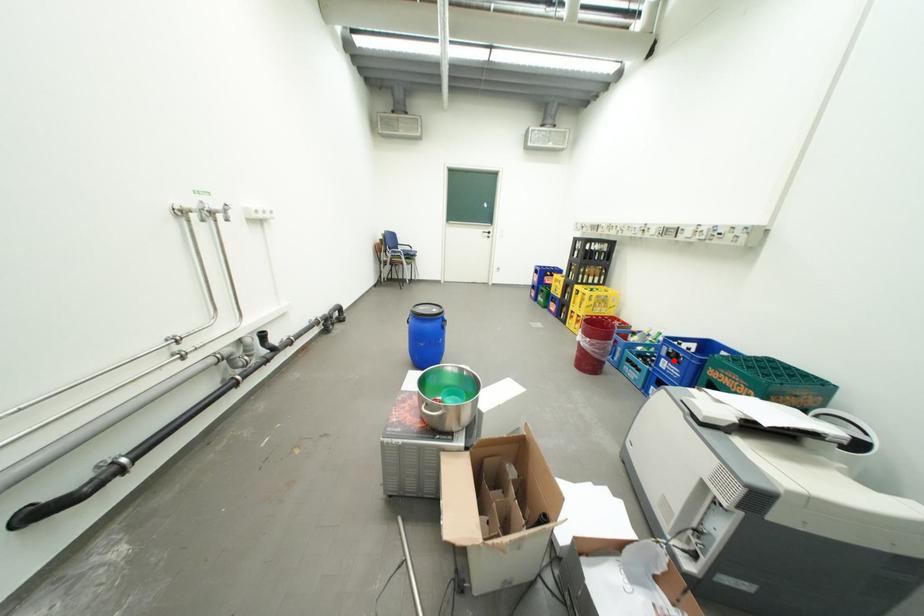
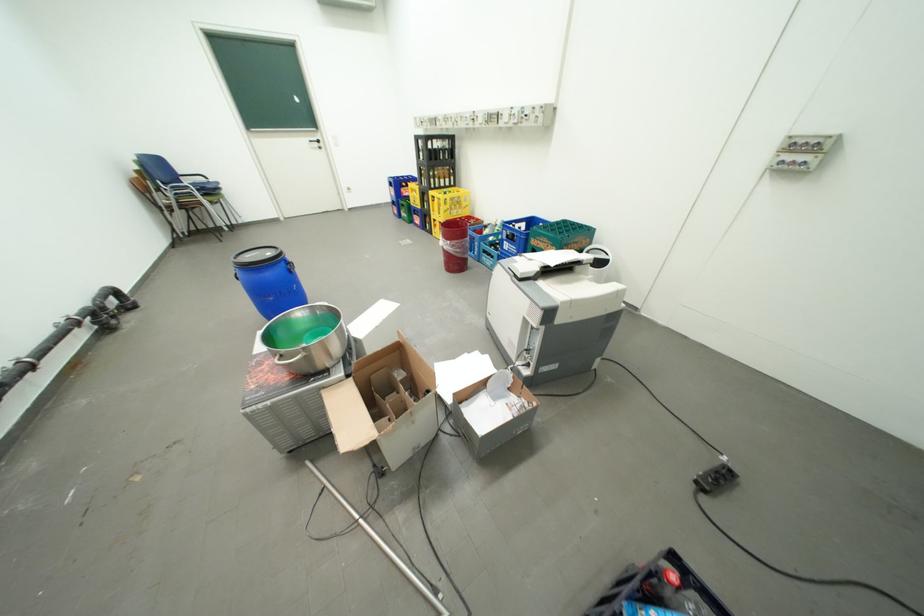
Where in the second image is the point corresponding to the highlighted location from the first image?

(516, 244)